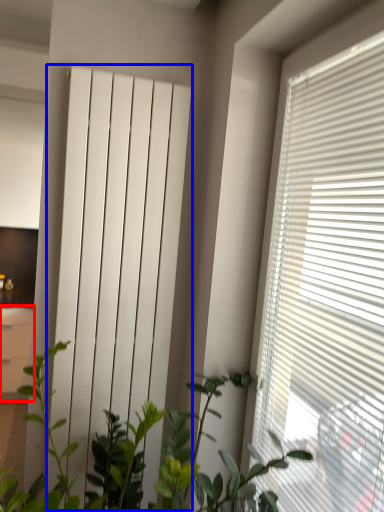
Question: Among these objects, which one is nearest to the camera, file cabinet (highlighted by a red box) or curtain (highlighted by a blue box)?

Choices:
 (A) file cabinet
 (B) curtain

Answer: (B)